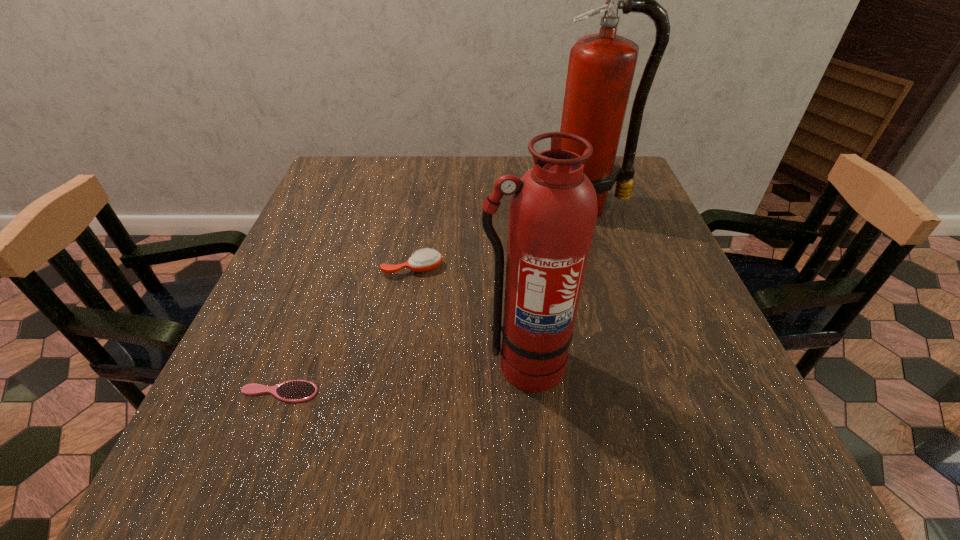
This screenshot has height=540, width=960. What are the coordinates of `the right fire extinguisher` in the screenshot? It's located at (601, 67).

This screenshot has width=960, height=540. I want to click on the farthest object, so click(601, 67).

What are the coordinates of `the nearer fire extinguisher` in the screenshot? It's located at (553, 209).

Find the location of a particular element. The image size is (960, 540). the left fire extinguisher is located at coordinates coord(553,209).

This screenshot has height=540, width=960. I want to click on the third object from right to left, so click(424, 260).

At what (x,y) coordinates should I click in order to perform the action: click on the taller hairbrush. Please return your answer as a coordinate pair (x, y). The height and width of the screenshot is (540, 960). Looking at the image, I should click on (424, 260).

Locate an element on the screen. the nearer hairbrush is located at coordinates (294, 391).

Identify the location of the left hairbrush. Image resolution: width=960 pixels, height=540 pixels. (294, 391).

The width and height of the screenshot is (960, 540). Find the location of `free region located 0.370m at the nozzle of the farther fire extinguisher`. free region located 0.370m at the nozzle of the farther fire extinguisher is located at coordinates (631, 342).

Find the location of a particular element. The width and height of the screenshot is (960, 540). free spot located 0.130m on the label side of the second object from right to left is located at coordinates (533, 470).